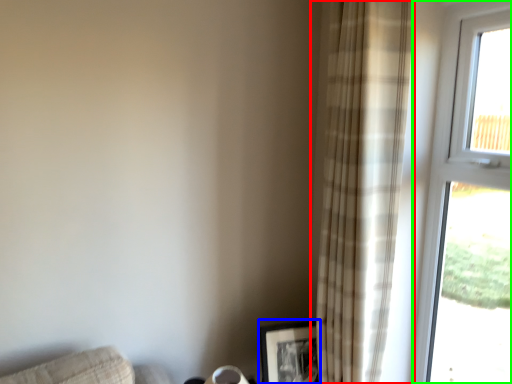
Question: Which object is the closest to the curtain (highlighted by a red box)? Choose among these: picture frame (highlighted by a blue box) or window (highlighted by a green box).

Choices:
 (A) picture frame
 (B) window

Answer: (B)